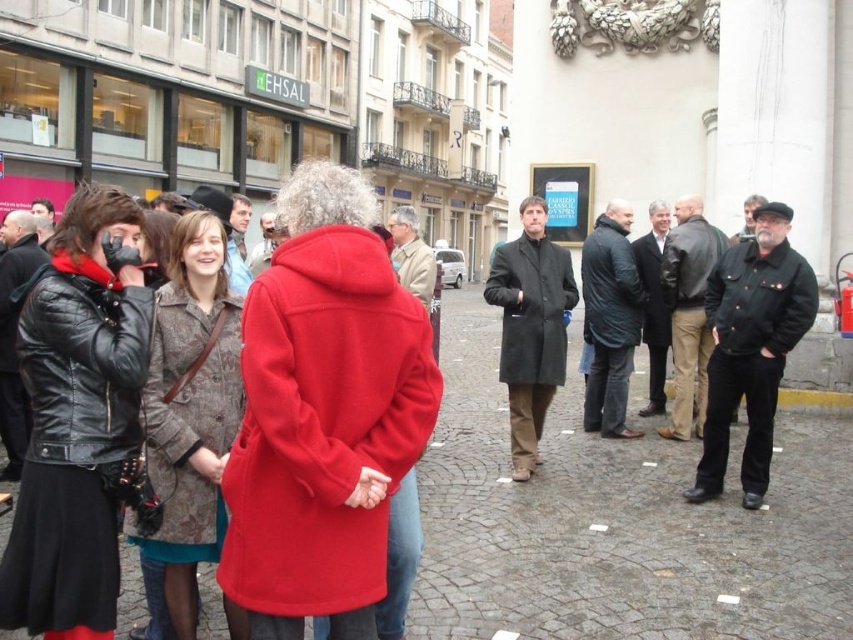
Does matte black coat at center appear over matte beige coat at center?

No.

Which is in front, point (544, 289) or point (433, 273)?

Point (544, 289) is more forward.

Find the location of a particular element. matte black coat at center is located at coordinates (531, 308).

Which is above, matte black leather jacket at left or matte black coat at center?

matte black coat at center is above.

Can you confirm if matte black leather jacket at left is thinner than matte black coat at center?

Yes, matte black leather jacket at left is thinner than matte black coat at center.

Does point (100, 372) come behind point (524, 241)?

No, it is in front of (524, 241).

Image resolution: width=853 pixels, height=640 pixels. Identify the location of matte black leather jacket at left. (82, 362).

Which is above, black leather jacket at left or matte beige coat at center?

matte beige coat at center

Is point (90, 433) closer to viewer compared to point (430, 296)?

Yes, point (90, 433) is closer to viewer.

Which is behind, point (67, 268) or point (428, 276)?

Positioned behind is point (428, 276).

At what (x,y) coordinates should I click in order to perform the action: click on black leather jacket at left. Please return your answer as a coordinate pair (x, y). The height and width of the screenshot is (640, 853). Looking at the image, I should click on (77, 419).